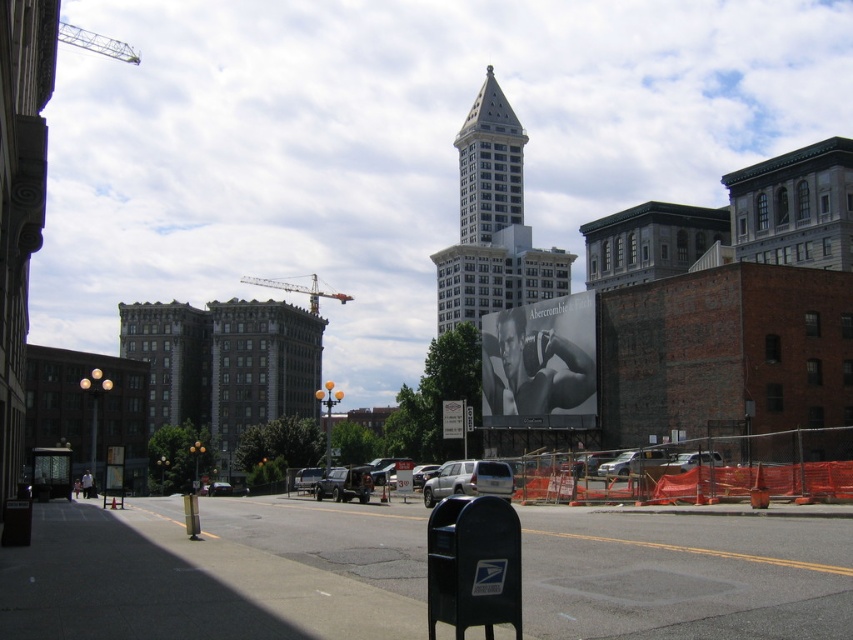
Question: Which of these objects is positioned closest to the silver metallic sedan at center?

Choices:
 (A) black plastic mailbox at lower center
 (B) white stone tower at center
 (C) orange mesh fence at center
 (D) metallic silver car at center

Answer: (D)

Question: Can you confirm if metallic construction crane at upper left is positioned to the right of metallic construction crane at center?

Choices:
 (A) yes
 (B) no

Answer: (B)

Question: Does black and white photograph at center have a larger size compared to satin silver suv at center?

Choices:
 (A) yes
 (B) no

Answer: (A)

Question: Which of the following is the closest to the observer?

Choices:
 (A) satin silver suv at center
 (B) metallic silver car at center
 (C) white stone tower at center
 (D) silver metallic sedan at center

Answer: (A)

Question: In this image, where is white glass tower at center located relative to metallic silver car at center?

Choices:
 (A) above
 (B) below

Answer: (A)

Question: Which object is farther from the camera taking this photo?

Choices:
 (A) white stone tower at center
 (B) satin silver suv at center
 (C) metallic construction crane at center
 (D) silver metallic sedan at center

Answer: (C)